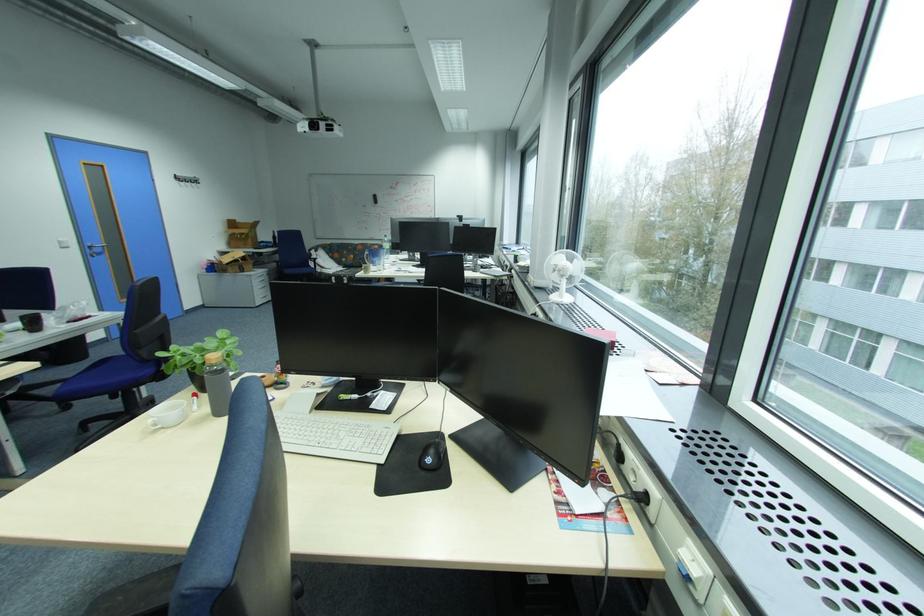
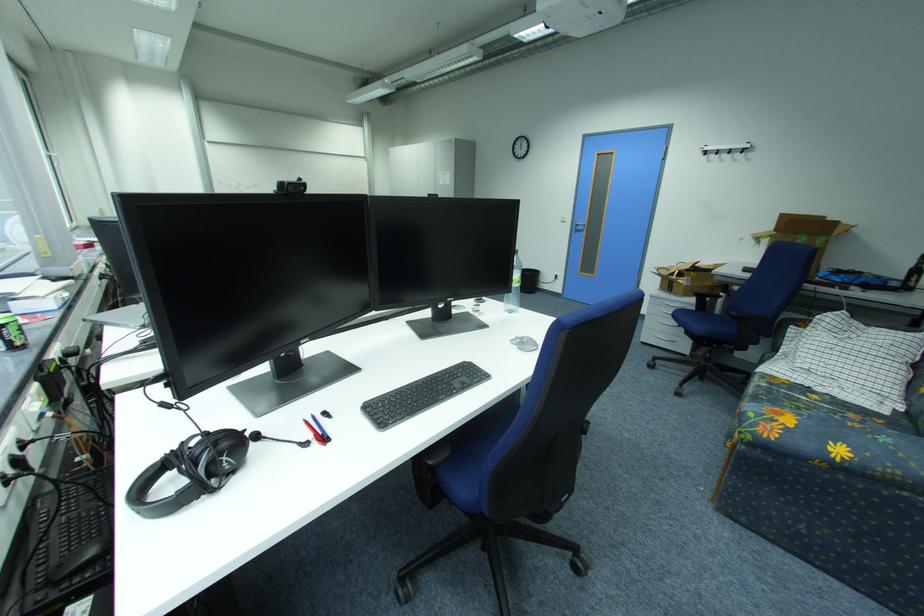
In the second image, find the point that corresponds to point 78,248 in the first image.

(574, 223)